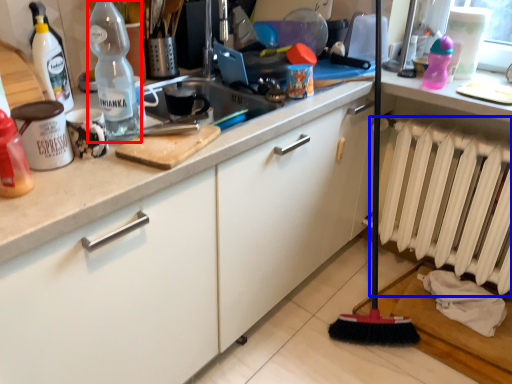
Question: Which object is further to the camera taking this photo, bottle (highlighted by a red box) or radiator (highlighted by a blue box)?

Choices:
 (A) bottle
 (B) radiator

Answer: (B)